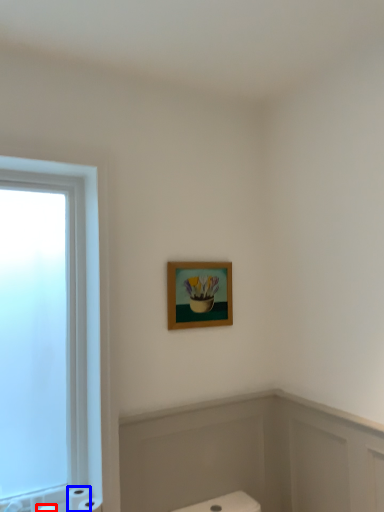
Question: Among these objects, which one is farthest to the camera, toilet paper (highlighted by a red box) or toilet paper (highlighted by a blue box)?

Choices:
 (A) toilet paper
 (B) toilet paper

Answer: (B)